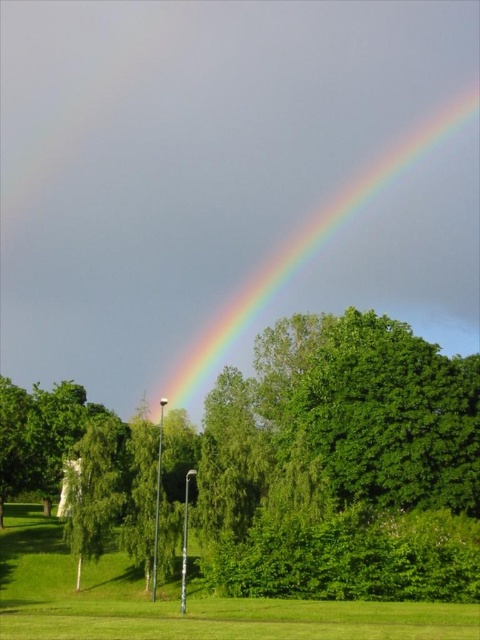
You are standing in the middle of a field and see the green leafy tree at center and the green grass at lower center. Which object is located higher in the scene?

The green leafy tree at center is located higher than the green grass at lower center.

You are a painter standing in the middle of the green grass at lower center, looking up at the rainbow at upper center. Which object is wider from your perspective?

The rainbow at upper center is wider than the green grass at lower center from your perspective.